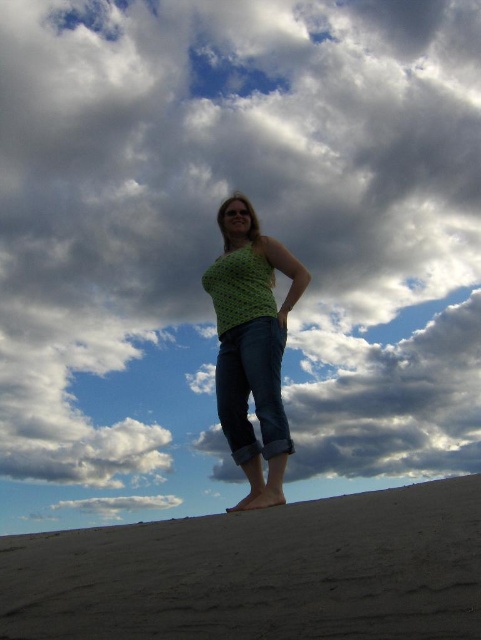
You are a photographer trying to capture the person in the image. Since you want to focus on the green crochet tank top at center, which is taller than the dark brown sand at lower center, where should you position your camera relative to the person?

Since the green crochet tank top at center is taller than the dark brown sand at lower center, positioning the camera at a lower angle would help emphasize the tank top by placing it above the sand, making it the focal point.